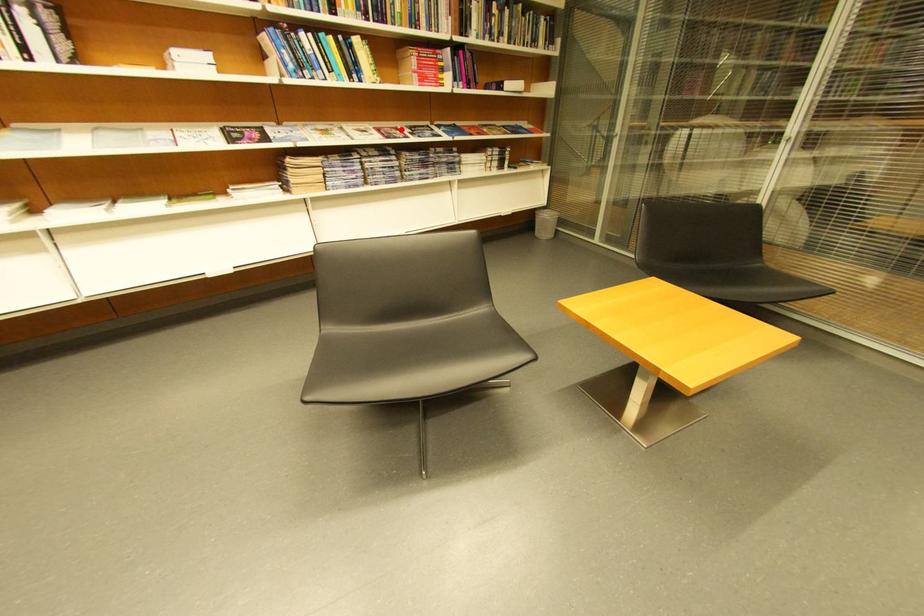
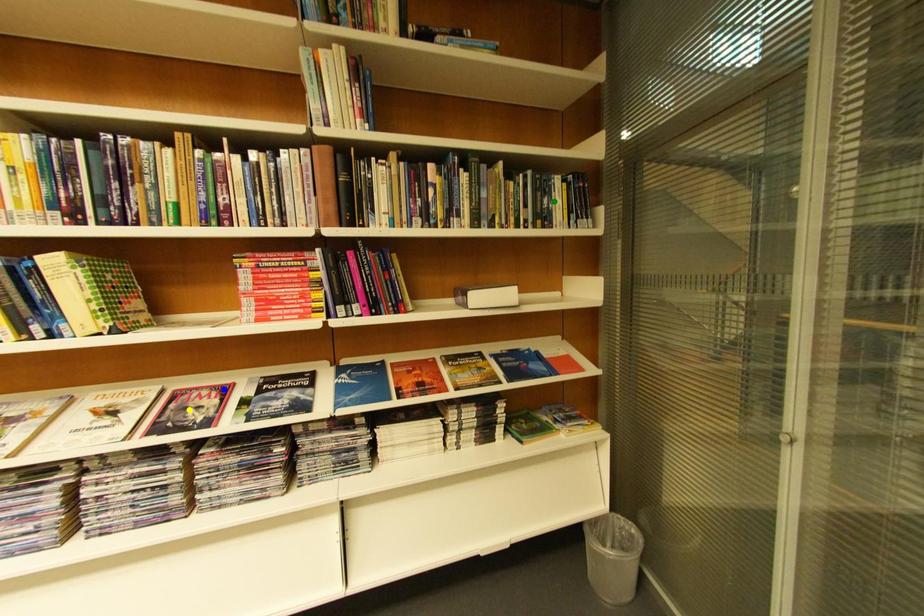
Question: I am providing you with two images of the same scene from different viewpoints. A red point is marked on the first image. You are given multiple points on the second image. Which spot in image 2 lines up with the point in image 1?

Choices:
 (A) green point
 (B) yellow point
 (C) blue point

Answer: (C)